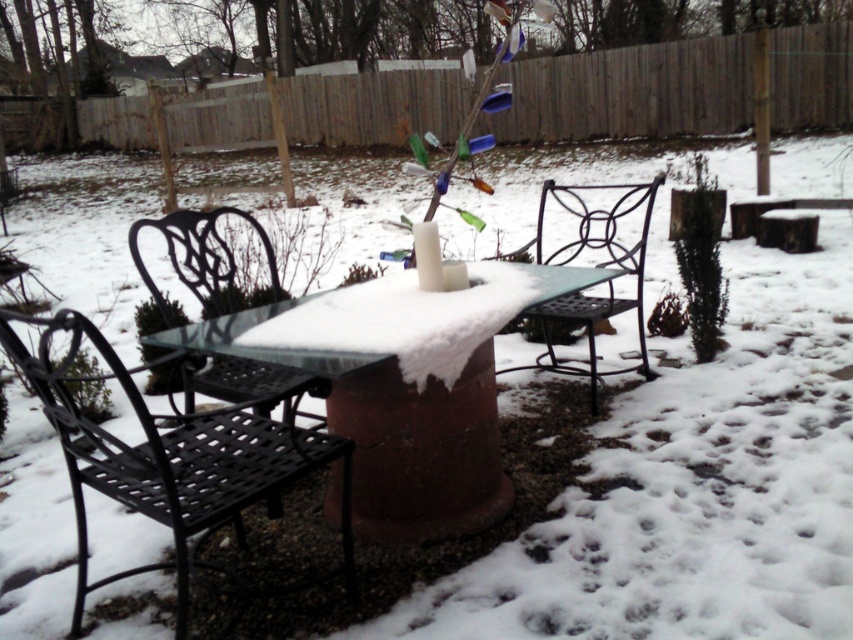
Which is more to the right, black wrought iron chair at lower left or black wrought iron chair at center?

From the viewer's perspective, black wrought iron chair at center appears more on the right side.

Identify the location of black wrought iron chair at lower left. The image size is (853, 640). (166, 456).

I want to click on black wrought iron chair at lower left, so 166,456.

At what (x,y) coordinates should I click in order to perform the action: click on black wrought iron chair at lower left. Please return your answer as a coordinate pair (x, y). The image size is (853, 640). Looking at the image, I should click on (166, 456).

What do you see at coordinates (392, 432) in the screenshot? I see `snow-covered glass table at center` at bounding box center [392, 432].

Does point (456, 387) come closer to viewer compared to point (142, 266)?

Yes, it is.

The height and width of the screenshot is (640, 853). Identify the location of snow-covered glass table at center. tap(392, 432).

Can you confirm if snow-covered glass table at center is wider than black wrought iron chair at center?

Yes.

Is snow-covered glass table at center below black wrought iron chair at center?

Indeed, snow-covered glass table at center is positioned under black wrought iron chair at center.

You are a GUI agent. You are given a task and a screenshot of the screen. Output one action in this format:
    pyautogui.click(x=<x>, y=<y>)
    Task: Click on the snow-covered glass table at center
    The image size is (853, 640).
    Given the screenshot: What is the action you would take?
    pyautogui.click(x=392, y=432)